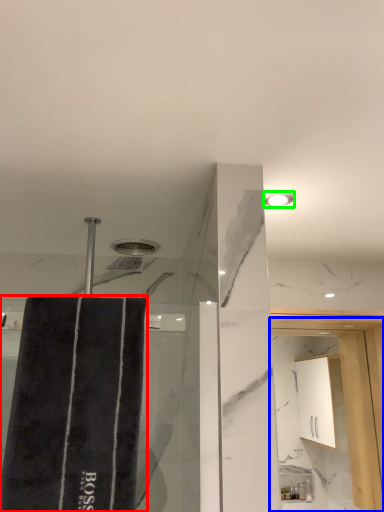
Question: Based on their relative distances, which object is nearer to bath towel (highlighted by a red box)? Choose from screen door (highlighted by a blue box) and light fixture (highlighted by a green box).

Choices:
 (A) screen door
 (B) light fixture

Answer: (B)